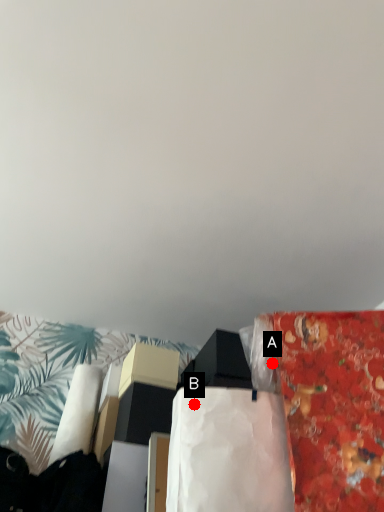
Question: Two points are circled on the image, labeled by A and B beside each circle. Which point is further to the camera?

Choices:
 (A) A is further
 (B) B is further

Answer: (A)